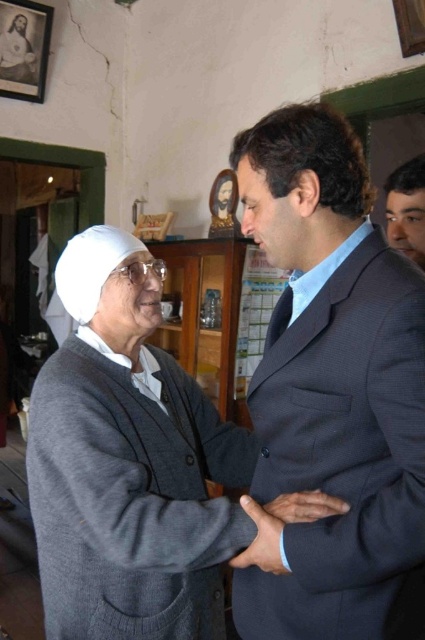
Can you confirm if gray fabric hand at center is positioned above blue woven tie at center?

Actually, gray fabric hand at center is below blue woven tie at center.

Which is above, gray fabric hand at center or blue woven tie at center?

blue woven tie at center is higher up.

The width and height of the screenshot is (425, 640). I want to click on gray fabric hand at center, so click(261, 540).

Image resolution: width=425 pixels, height=640 pixels. What do you see at coordinates (334, 390) in the screenshot?
I see `dark blue suit at center` at bounding box center [334, 390].

Who is more distant from viewer, [342,580] or [303,502]?

The point [303,502] is more distant.

Locate an element on the screen. dark blue suit at center is located at coordinates (334, 390).

Is gray fabric hand at center thinner than smooth skin hand at center?

Correct, gray fabric hand at center's width is less than smooth skin hand at center's.

Who is more forward, (249, 552) or (280, 515)?

Point (280, 515) is in front.

Locate an element on the screen. The width and height of the screenshot is (425, 640). gray fabric hand at center is located at coordinates (261, 540).